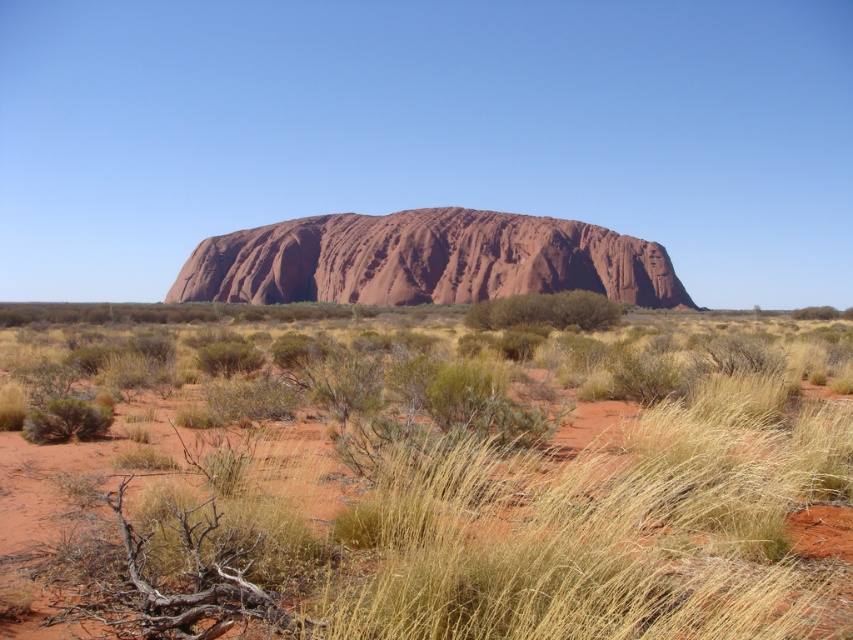
Does yellow dry grass at center lie behind reddish-brown rock at center?

No.

Does yellow dry grass at center have a lesser width compared to reddish-brown rock at center?

Yes, yellow dry grass at center is thinner than reddish-brown rock at center.

Locate an element on the screen. The height and width of the screenshot is (640, 853). yellow dry grass at center is located at coordinates (432, 480).

Who is shorter, reddish-brown rock at center or green shrub at center?

green shrub at center

Measure the distance from reddish-brown rock at center to green shrub at center.

reddish-brown rock at center is 310.21 feet away from green shrub at center.

Is point (431, 269) positioned behind point (606, 305)?

Yes, point (431, 269) is behind point (606, 305).

Locate an element on the screen. reddish-brown rock at center is located at coordinates (425, 260).

Can you confirm if yellow dry grass at center is bigger than green shrub at center?

Yes, yellow dry grass at center is bigger than green shrub at center.

Is point (578, 436) more distant than point (572, 300)?

No, (578, 436) is closer to viewer.

Who is more forward, (210, 516) or (587, 292)?

Positioned in front is point (210, 516).

You are a GUI agent. You are given a task and a screenshot of the screen. Output one action in this format:
    pyautogui.click(x=<x>, y=<y>)
    Task: Click on the yellow dry grass at center
    
    Given the screenshot: What is the action you would take?
    pyautogui.click(x=432, y=480)